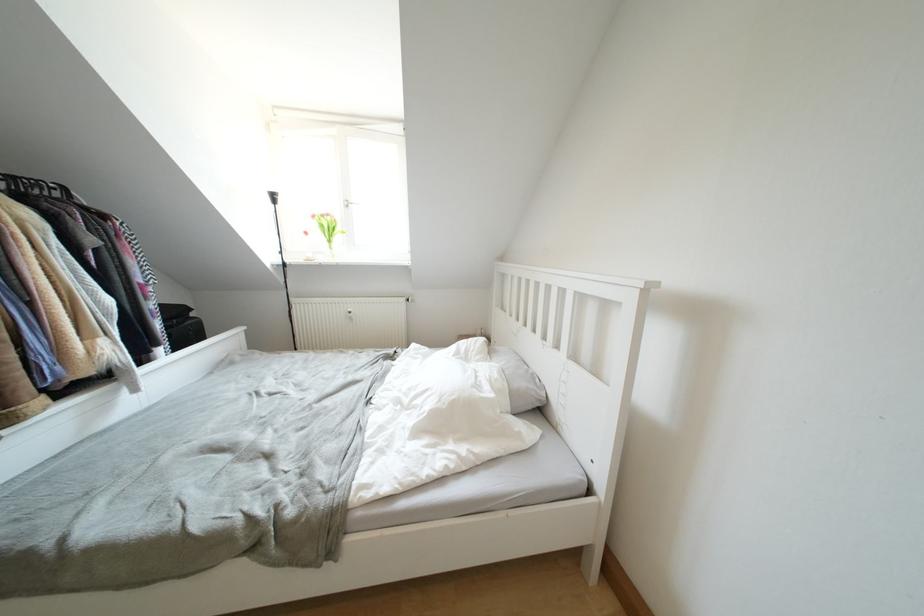
Find where to lift the white pillow. Please return your answer as a coordinate pair (x, y).

(517, 379)